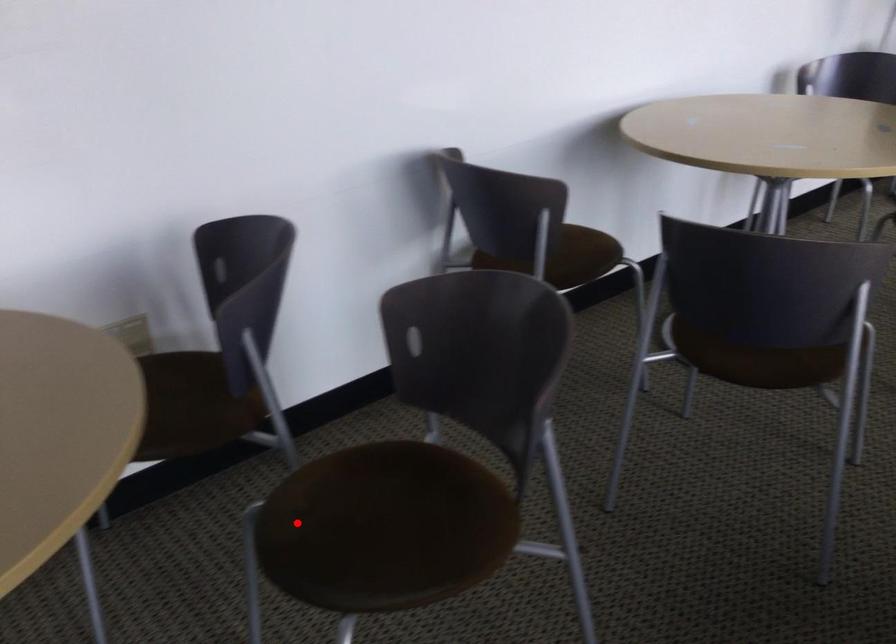
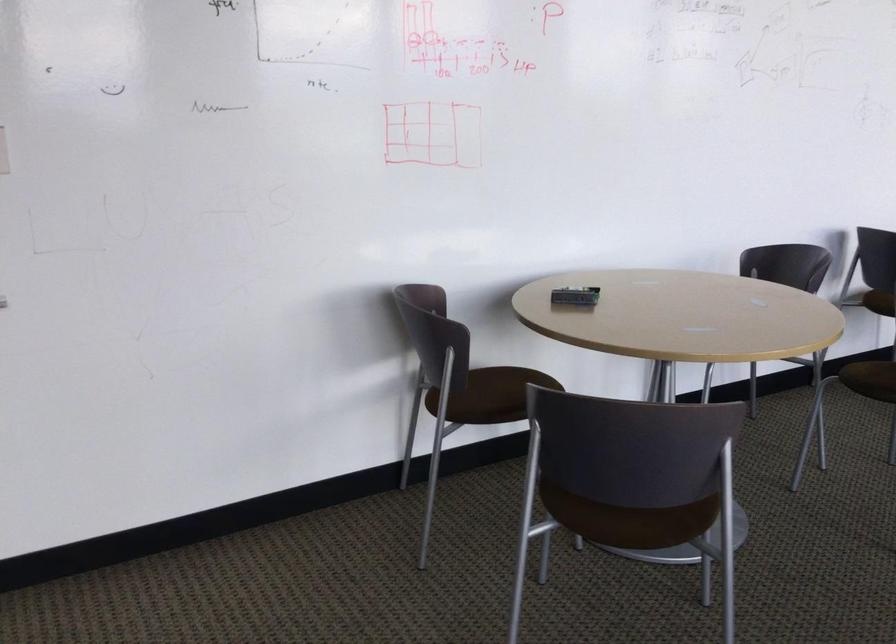
Question: I am providing you with two images of the same scene from different viewpoints. A red point is marked on the first image. Can you still see the location of the red point in image 2?

Choices:
 (A) Yes
 (B) No

Answer: (A)